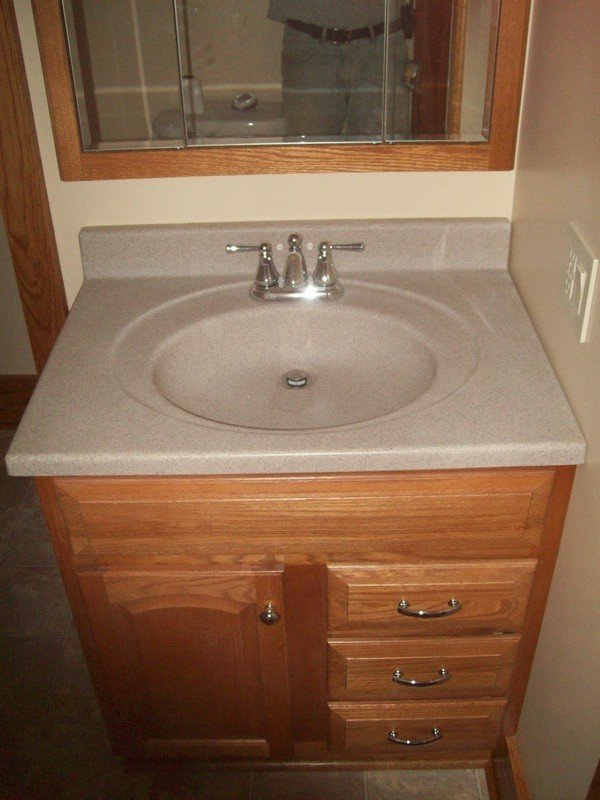
Identify the location of cabinet under the sink. (284, 656).